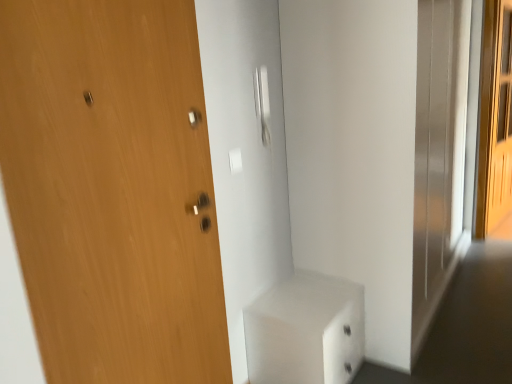
Question: Considering the relative sizes of white glossy cabinet at lower center and wooden door at left in the image provided, is white glossy cabinet at lower center smaller than wooden door at left?

Choices:
 (A) no
 (B) yes

Answer: (A)

Question: Is white glossy cabinet at lower center in contact with wooden door at left?

Choices:
 (A) yes
 (B) no

Answer: (B)

Question: Is the position of white glossy cabinet at lower center less distant than that of wooden door at left?

Choices:
 (A) yes
 (B) no

Answer: (B)

Question: Does white glossy cabinet at lower center turn towards wooden door at left?

Choices:
 (A) no
 (B) yes

Answer: (A)

Question: From a real-world perspective, is white glossy cabinet at lower center physically below wooden door at left?

Choices:
 (A) no
 (B) yes

Answer: (B)

Question: Would you say wooden door at left is to the left or to the right of light brown wooden screen door at right in the picture?

Choices:
 (A) right
 (B) left

Answer: (B)

Question: From their relative heights in the image, would you say wooden door at left is taller or shorter than light brown wooden screen door at right?

Choices:
 (A) short
 (B) tall

Answer: (A)

Question: Is wooden door at left wider or thinner than light brown wooden screen door at right?

Choices:
 (A) wide
 (B) thin

Answer: (B)

Question: Is wooden door at left inside or outside of light brown wooden screen door at right?

Choices:
 (A) inside
 (B) outside

Answer: (B)

Question: In terms of size, does white glossy cabinet at lower center appear bigger or smaller than light brown wooden screen door at right?

Choices:
 (A) big
 (B) small

Answer: (B)

Question: Looking at their shapes, would you say white glossy cabinet at lower center is wider or thinner than light brown wooden screen door at right?

Choices:
 (A) wide
 (B) thin

Answer: (A)

Question: Is point (331, 382) positioned closer to the camera than point (495, 51)?

Choices:
 (A) closer
 (B) farther

Answer: (A)

Question: In terms of height, does white glossy cabinet at lower center look taller or shorter compared to light brown wooden screen door at right?

Choices:
 (A) short
 (B) tall

Answer: (A)

Question: Considering the positions of light brown wooden screen door at right and wooden door at left in the image, is light brown wooden screen door at right bigger or smaller than wooden door at left?

Choices:
 (A) big
 (B) small

Answer: (A)

Question: Would you say light brown wooden screen door at right is inside or outside wooden door at left?

Choices:
 (A) inside
 (B) outside

Answer: (B)